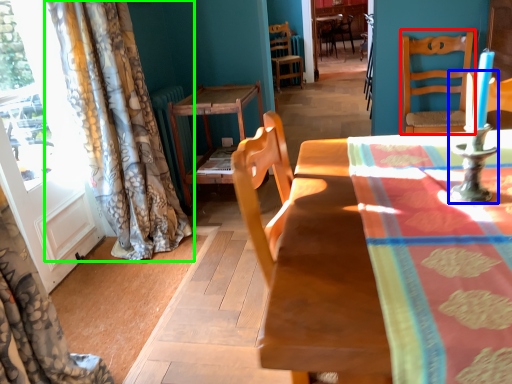
Question: Based on their relative distances, which object is farther from chair (highlighted by a red box)? Choose from candle holder (highlighted by a blue box) and curtain (highlighted by a green box).

Choices:
 (A) candle holder
 (B) curtain

Answer: (A)